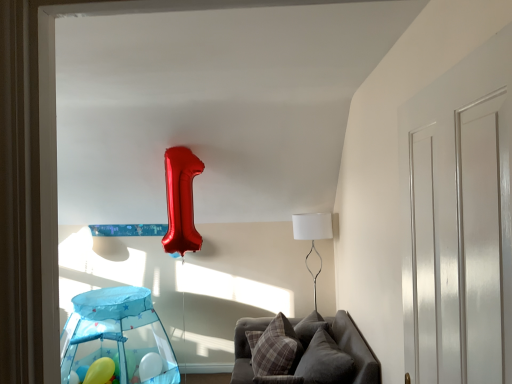
Question: Considering the relative sizes of matte yellow balloon at lower left and plaid fabric pillow at lower center, which is the 2th pillow from right to left, in the image provided, is matte yellow balloon at lower left bigger than plaid fabric pillow at lower center, which is the 2th pillow from right to left,?

Choices:
 (A) yes
 (B) no

Answer: (B)

Question: From the image's perspective, is matte yellow balloon at lower left on plaid fabric pillow at lower center, positioned as the 1th pillow in left-to-right order?

Choices:
 (A) yes
 (B) no

Answer: (B)

Question: Is matte yellow balloon at lower left far away from plaid fabric pillow at lower center, which is the 2th pillow from right to left?

Choices:
 (A) no
 (B) yes

Answer: (B)

Question: From a real-world perspective, is matte yellow balloon at lower left located higher than plaid fabric pillow at lower center, positioned as the 1th pillow in left-to-right order?

Choices:
 (A) yes
 (B) no

Answer: (B)

Question: Can you confirm if matte yellow balloon at lower left is taller than plaid fabric pillow at lower center, positioned as the 1th pillow in left-to-right order?

Choices:
 (A) no
 (B) yes

Answer: (A)

Question: Is matte yellow balloon at lower left to the right of plaid fabric pillow at lower center, positioned as the 1th pillow in left-to-right order, from the viewer's perspective?

Choices:
 (A) yes
 (B) no

Answer: (B)

Question: Is matte yellow balloon at lower left at the left side of transparent plastic play tent at lower left?

Choices:
 (A) yes
 (B) no

Answer: (A)

Question: Is matte yellow balloon at lower left positioned in front of transparent plastic play tent at lower left?

Choices:
 (A) yes
 (B) no

Answer: (B)

Question: Does matte yellow balloon at lower left have a larger size compared to transparent plastic play tent at lower left?

Choices:
 (A) no
 (B) yes

Answer: (A)

Question: Is matte yellow balloon at lower left turned away from transparent plastic play tent at lower left?

Choices:
 (A) yes
 (B) no

Answer: (A)

Question: Does matte yellow balloon at lower left appear on the right side of transparent plastic play tent at lower left?

Choices:
 (A) no
 (B) yes

Answer: (A)

Question: Does matte yellow balloon at lower left have a greater height compared to transparent plastic play tent at lower left?

Choices:
 (A) yes
 (B) no

Answer: (B)

Question: Can you confirm if plaid fabric pillow at lower center, which is the 2th pillow from right to left, is shorter than velvet gray couch at lower center?

Choices:
 (A) no
 (B) yes

Answer: (B)